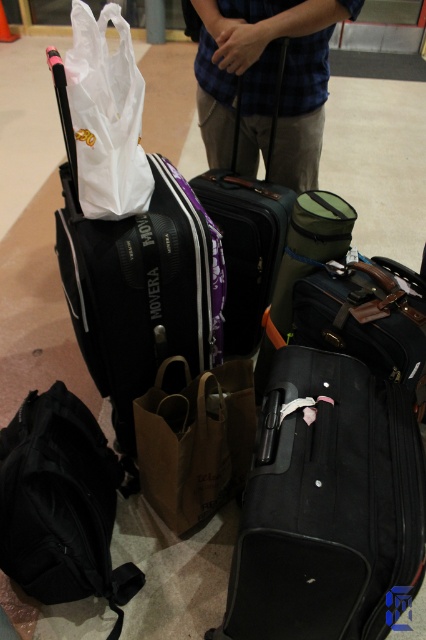
You are at the airport and need to locate two specific points marked on a map. The first point is labeled as point [213,156] and the second is point [247,353]. If you are facing the direction of travel, which point should you reach first?

Point [213,156] is in front of point [247,353], so you should reach point [213,156] first.

You are at an airport and need to retrieve your items before boarding. You see the blue plaid shirt at upper center and the brown paper bag at center. Which item is closer to you?

The brown paper bag at center is behind the blue plaid shirt at upper center, so the blue plaid shirt at upper center is closer to you.